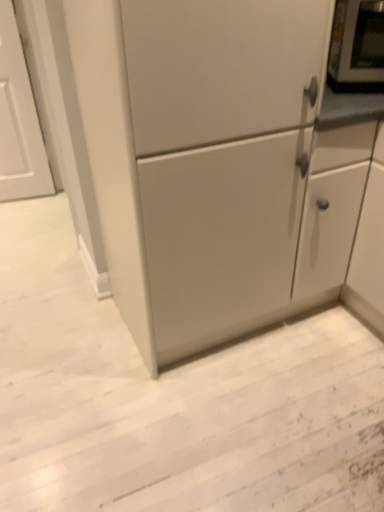
Locate an element on the screen. free space in front of matte white cabinet at center is located at coordinates (199, 434).